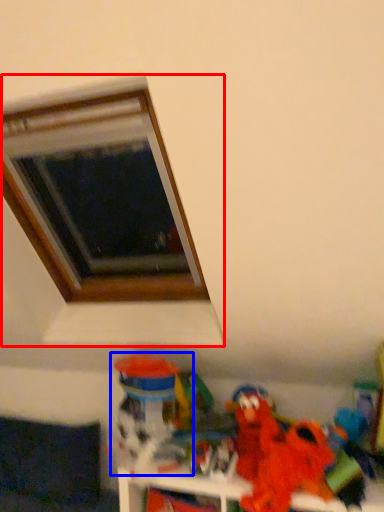
Question: Which of the following is the farthest to the observer, window (highlighted by a red box) or toy (highlighted by a blue box)?

Choices:
 (A) window
 (B) toy

Answer: (B)